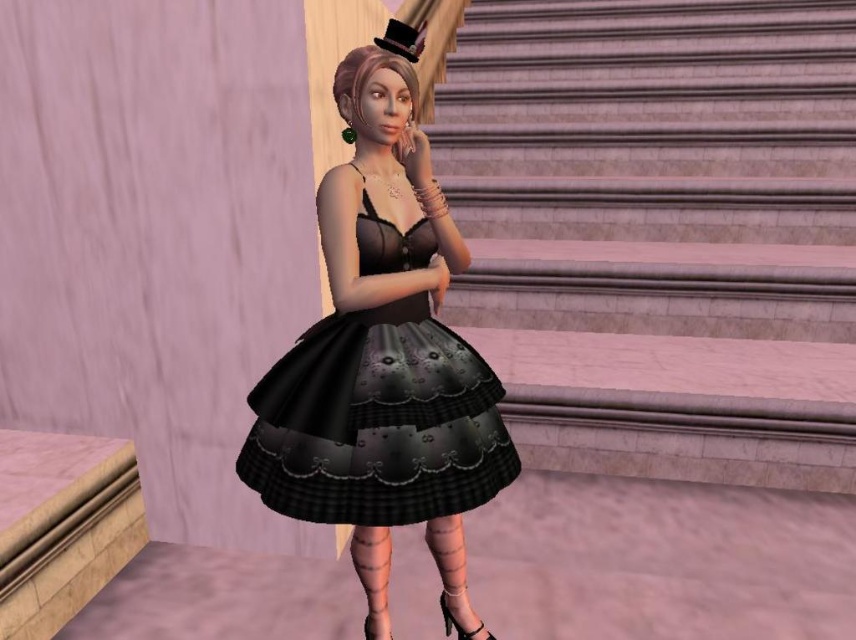
Question: Estimate the real-world distances between objects in this image. Which object is farther from the black satin dress at center?

Choices:
 (A) black felt top hat at upper center
 (B) marble stairs at center

Answer: (B)

Question: Can you confirm if marble stairs at center is positioned to the right of black satin dress at center?

Choices:
 (A) yes
 (B) no

Answer: (A)

Question: Which point is closer to the camera?

Choices:
 (A) marble stairs at center
 (B) black felt top hat at upper center
 (C) black satin dress at center

Answer: (C)

Question: Does black satin dress at center have a smaller size compared to black felt top hat at upper center?

Choices:
 (A) yes
 (B) no

Answer: (B)

Question: Among these points, which one is nearest to the camera?

Choices:
 (A) click(247, 451)
 (B) click(414, 38)
 (C) click(705, 51)

Answer: (B)

Question: Does marble stairs at center have a smaller size compared to black felt top hat at upper center?

Choices:
 (A) no
 (B) yes

Answer: (A)